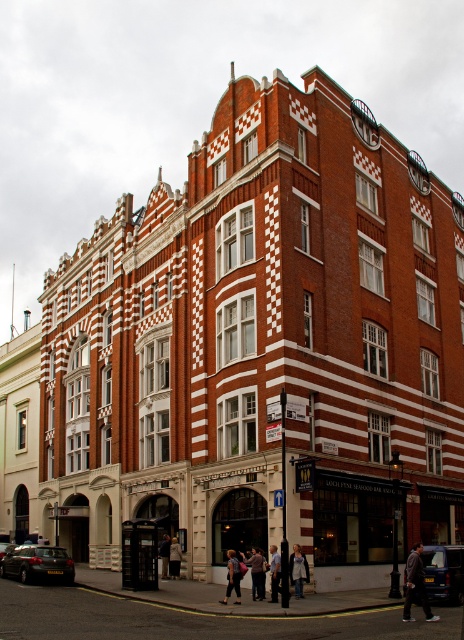
Question: Which of the following is the closest to the observer?

Choices:
 (A) (238, 604)
 (B) (411, 620)
 (C) (25, 570)

Answer: (B)

Question: Considering the relative positions of white cotton shirt at center and light brown leather jacket at center in the image provided, where is white cotton shirt at center located with respect to light brown leather jacket at center?

Choices:
 (A) left
 (B) right

Answer: (B)

Question: From the image, what is the correct spatial relationship of dark brown leather jacket at lower right in relation to light beige fabric coat at lower center?

Choices:
 (A) left
 (B) right

Answer: (B)

Question: Is dark brown leather jacket at lower right behind light brown leather jacket at lower center?

Choices:
 (A) no
 (B) yes

Answer: (A)

Question: Estimate the real-world distances between objects in this image. Which object is closer to the white cotton shirt at center?

Choices:
 (A) light brown leather jacket at lower center
 (B) light brown leather jacket at center
 (C) light beige fabric handbag at lower center

Answer: (B)

Question: Based on their relative distances, which object is farther from the light beige fabric coat at lower center?

Choices:
 (A) metallic silver hatchback at lower left
 (B) light beige fabric handbag at lower center
 (C) dark brown leather jacket at lower right
 (D) light brown leather jacket at lower center

Answer: (C)